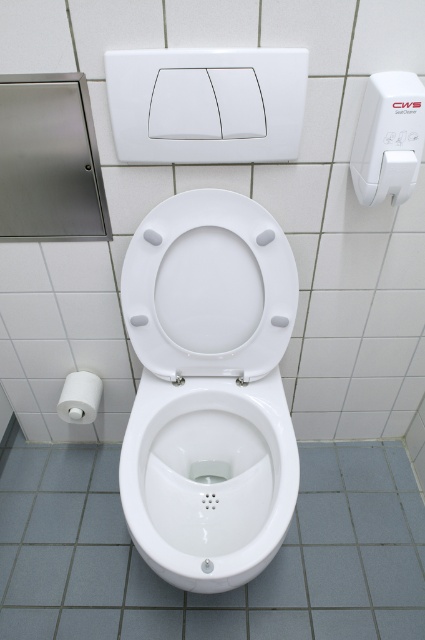
Question: Does white glossy toilet at center come behind white glossy toilet seat at center?

Choices:
 (A) yes
 (B) no

Answer: (A)

Question: Which object is positioned farthest from the white glossy toilet seat at center?

Choices:
 (A) white matte toilet paper at lower left
 (B) white glossy toilet bowl at center

Answer: (A)

Question: Which object is farther from the camera taking this photo?

Choices:
 (A) white glossy toilet at center
 (B) white glossy toilet bowl at center
 (C) white glossy toilet seat at center

Answer: (A)

Question: In this image, where is white glossy toilet at center located relative to white glossy toilet bowl at center?

Choices:
 (A) left
 (B) right

Answer: (A)

Question: Which point is closer to the camera taking this photo?

Choices:
 (A) (226, 496)
 (B) (96, 410)
 (C) (27, 500)
 (D) (241, 218)

Answer: (D)

Question: Is white glossy toilet at center to the left of white matte toilet paper at lower left from the viewer's perspective?

Choices:
 (A) no
 (B) yes

Answer: (A)